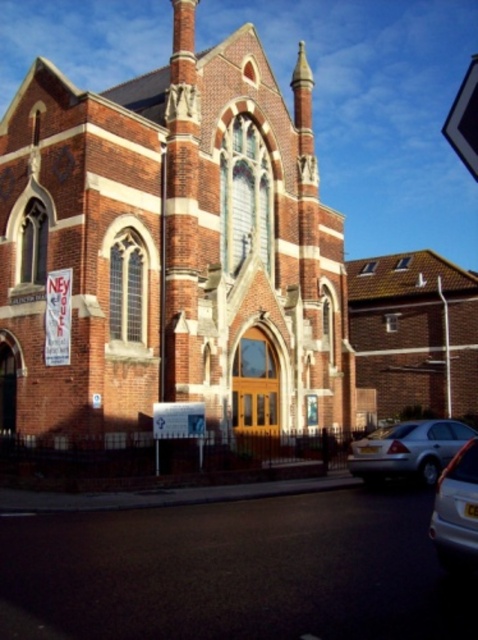
You are driving a car that is 5 meters long and want to park it in the parking lot near the brick church at center. The parking spot next to the silver metallic sedan at lower right is 6 meters long. Can your car fit into that parking spot?

The parking spot next to the silver metallic sedan at lower right is 6 meters long. Your car is 5 meters long, so it can fit into the parking spot.

You are a visitor arriving at the church and see the silver metallic sedan at lower right and the metallic silver car at lower right. Which one is closer to the entrance?

The silver metallic sedan at lower right is closer to the entrance because the metallic silver car at lower right is behind it.

From the picture: You are standing in a park and see the brick church at center. If you want to take a photo of the church from the front, where should you position yourself relative to the church?

Since the brick church at center is located at point (171, 256), you should position yourself directly in front of the church to capture the front view in your photo.